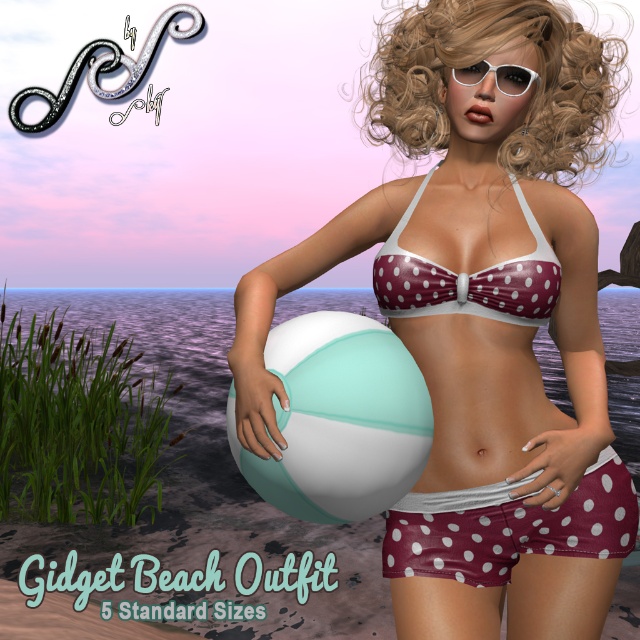
Question: Can you confirm if maroon polka dot bikini at center is positioned above maroon satin shorts at lower center?

Choices:
 (A) yes
 (B) no

Answer: (A)

Question: Is white matte/beach ball at center wider than maroon polka dot bikini top at center?

Choices:
 (A) no
 (B) yes

Answer: (A)

Question: Among these points, which one is farthest from the camera?

Choices:
 (A) (376, 284)
 (B) (509, 84)

Answer: (A)

Question: Based on their relative distances, which object is nearer to the white matte glasses at upper center?

Choices:
 (A) white matte/beach ball at center
 (B) maroon polka dot bikini at center
 (C) blonde curly hair at upper center
 (D) maroon polka dot bikini top at center

Answer: (D)

Question: Does maroon polka dot bikini at center appear on the right side of maroon satin shorts at lower center?

Choices:
 (A) yes
 (B) no

Answer: (A)

Question: Which of the following is the closest to the observer?

Choices:
 (A) maroon polka dot bikini top at center
 (B) white matte/beach ball at center
 (C) blonde curly hair at upper center

Answer: (B)